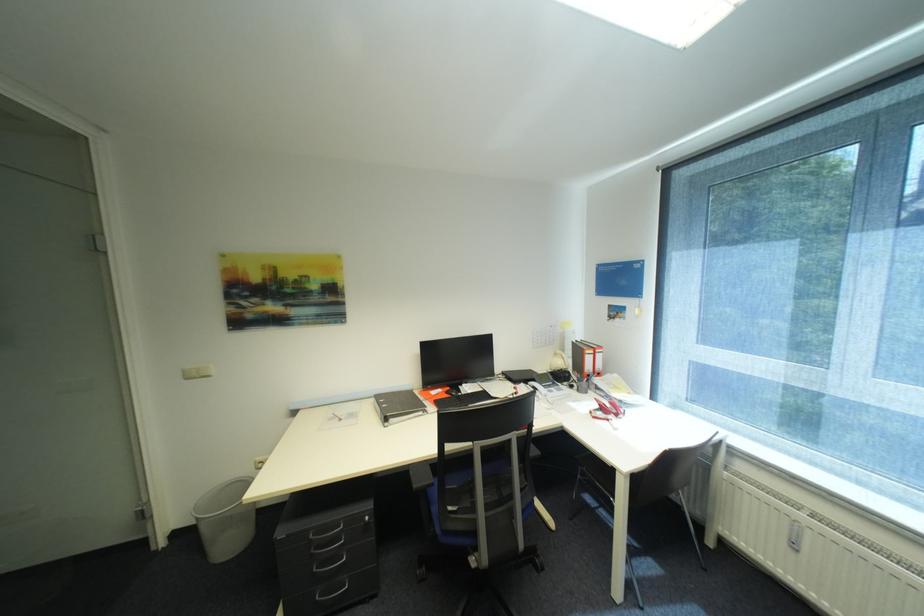
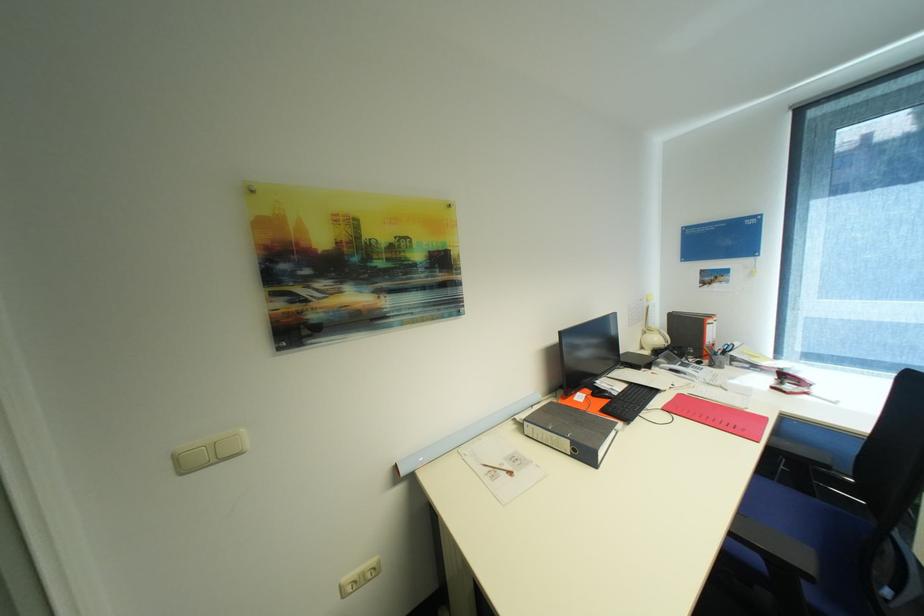
What movement of the cameraman would produce the second image?

The cameraman walked toward left, forward.